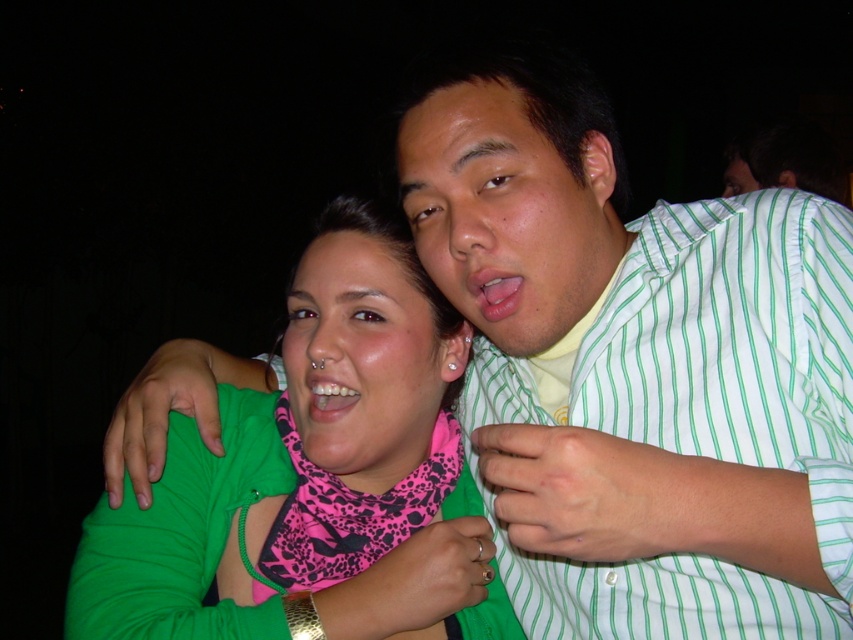
You are a photographer trying to capture the green fabric at center in the image. The camera is focused on the point at coordinates point (315, 477). Is the green fabric at center in focus?

The point (315, 477) indicates green fabric at center, so yes, the green fabric at center is in focus.

You are a photographer trying to edit this image. You want to place a decorative border around the green striped shirt at upper right. To do this, you need to know the exact 2D coordinates of the shirt. What are the coordinates?

The 2D coordinates of the green striped shirt at upper right are at point (699, 410).